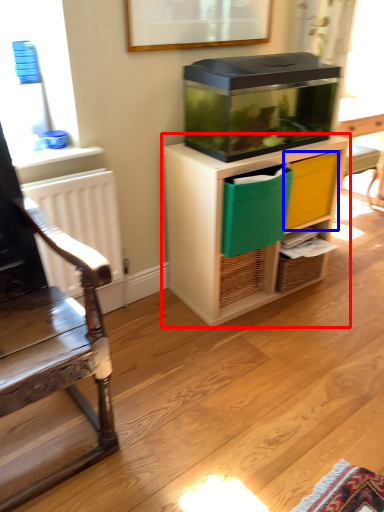
Question: Which point is closer to the camera, cabinetry (highlighted by a red box) or drawer (highlighted by a blue box)?

Choices:
 (A) cabinetry
 (B) drawer

Answer: (A)